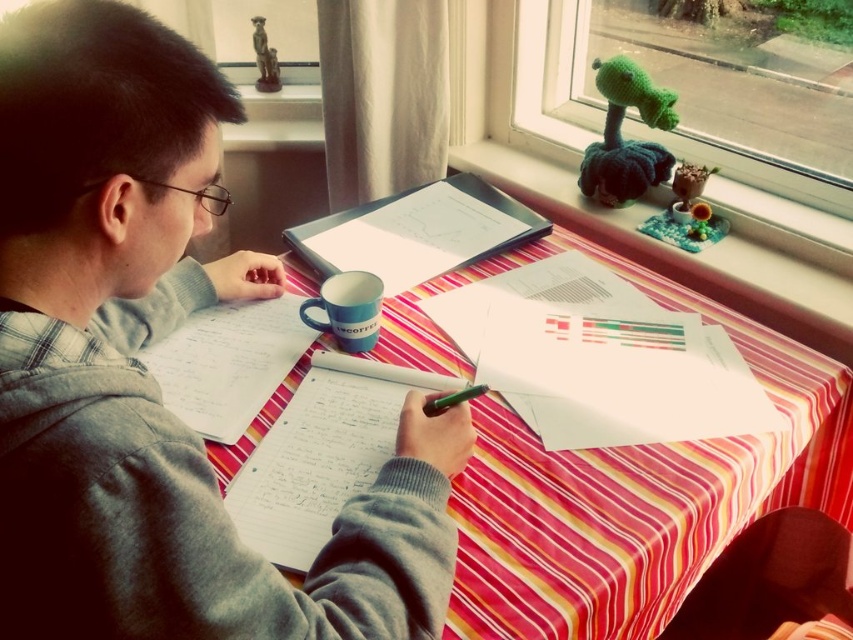
Who is taller, gray fleece hoodie at upper left or striped fabric table at center?

gray fleece hoodie at upper left

The height and width of the screenshot is (640, 853). What do you see at coordinates (149, 376) in the screenshot? I see `gray fleece hoodie at upper left` at bounding box center [149, 376].

Find the location of `gray fleece hoodie at upper left`. gray fleece hoodie at upper left is located at coordinates (x=149, y=376).

Is white paper at center positioned before striped fabric table at center?

No, white paper at center is further to the viewer.

The height and width of the screenshot is (640, 853). What do you see at coordinates (416, 232) in the screenshot?
I see `white paper at center` at bounding box center [416, 232].

Is point (437, 186) closer to viewer compared to point (283, 348)?

No, (437, 186) is further to viewer.

Where is `white paper at center`? white paper at center is located at coordinates (416, 232).

Does point (349, 312) come farther from viewer compared to point (457, 396)?

Yes.

Between blue ceramic mug at center and green matte pen at center, which one appears on the right side from the viewer's perspective?

Positioned to the right is green matte pen at center.

Is point (349, 284) positioned before point (447, 406)?

That is False.

Image resolution: width=853 pixels, height=640 pixels. What are the coordinates of `blue ceramic mug at center` in the screenshot? It's located at (347, 308).